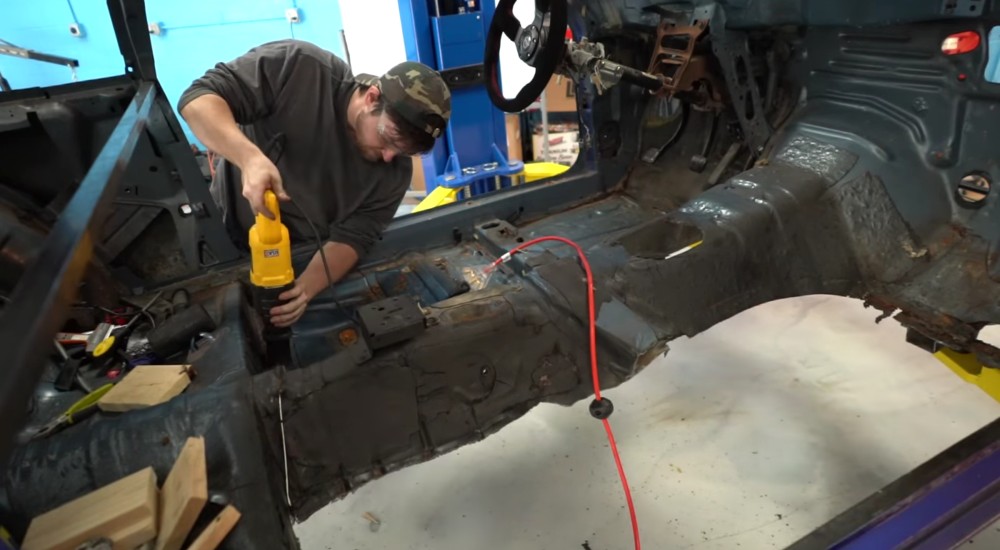
Identify the location of electic outlet. The image size is (1000, 550). (71, 30).